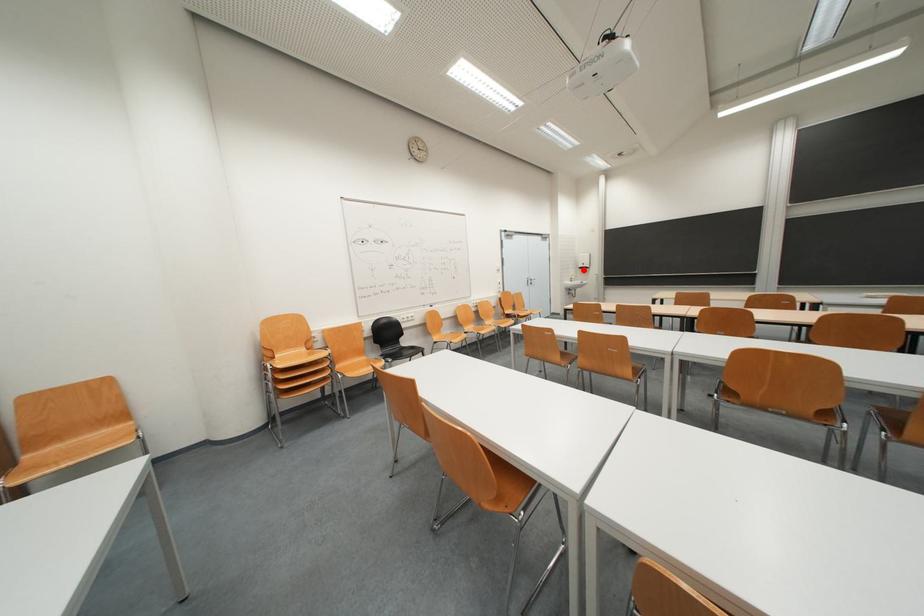
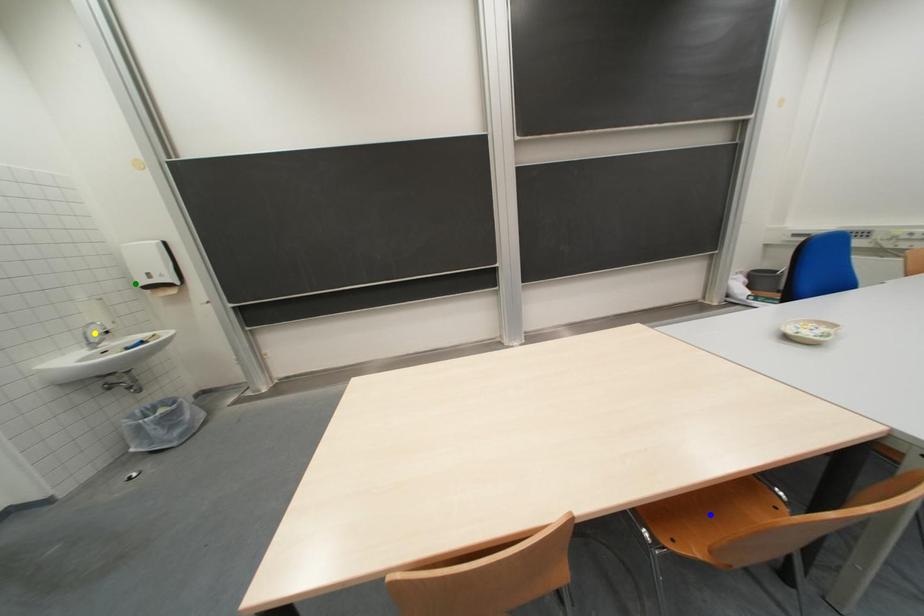
Question: I am providing you with two images of the same scene from different viewpoints. A red point is marked on the first image. You are given multiple points on the second image. Which spot in image 2 lines up with the point in image 1?

Choices:
 (A) green point
 (B) yellow point
 (C) blue point

Answer: (A)